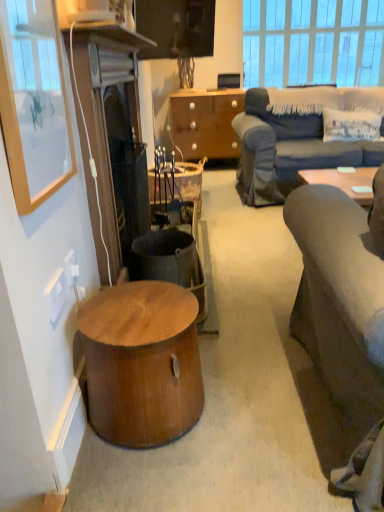
You are a GUI agent. You are given a task and a screenshot of the screen. Output one action in this format:
    pyautogui.click(x=<x>, y=<y>)
    Task: Click on the vacant area in front of wooden round stool at lower left
    This screenshot has width=384, height=512.
    Given the screenshot: What is the action you would take?
    pyautogui.click(x=150, y=480)